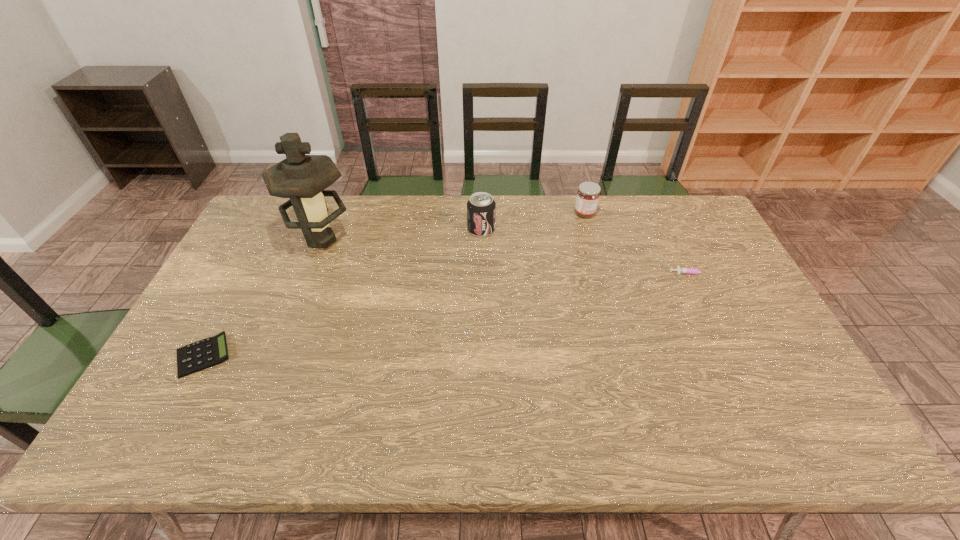
In the image, there is a desktop. Where is `blank space at the far edge`? The width and height of the screenshot is (960, 540). blank space at the far edge is located at coordinates (503, 205).

In the image, there is a desktop. Identify the location of vacant space at the near edge. (233, 448).

This screenshot has height=540, width=960. Identify the location of free space at the left edge. (240, 318).

Identify the location of vacant space at the far right corner. The width and height of the screenshot is (960, 540). (680, 214).

At what (x,y) coordinates should I click in order to perform the action: click on empty space between the nearest object and the soda can. Please return your answer as a coordinate pair (x, y). Looking at the image, I should click on (343, 293).

Find the location of `free space that is in between the jam and the syringe`. free space that is in between the jam and the syringe is located at coordinates (638, 243).

Identify the location of free space that is in between the calculator and the farthest object. This screenshot has height=540, width=960. (395, 285).

Locate an element on the screen. This screenshot has height=540, width=960. free space between the third object from left to right and the rightmost object is located at coordinates (587, 251).

I want to click on free spot between the third object from left to right and the tallest object, so 402,235.

Where is `free space that is in between the fourth farthest object and the calculator`? Image resolution: width=960 pixels, height=540 pixels. free space that is in between the fourth farthest object and the calculator is located at coordinates (447, 314).